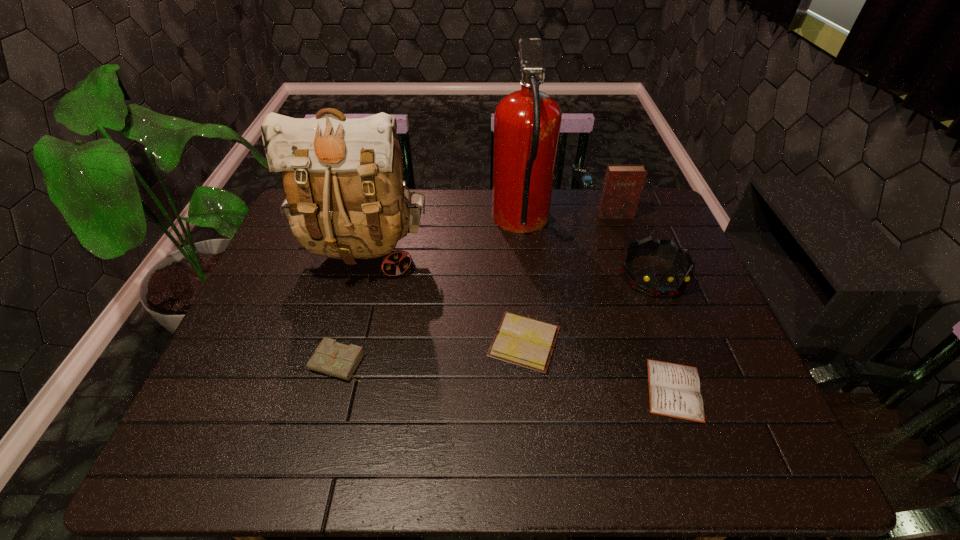
Locate an element on the screen. object that can be found as the closest to the third tallest object is located at coordinates (527, 122).

Identify which diary is the nearest to the backpack. Please provide its 2D coordinates. Your answer should be formatted as a tuple, i.e. [(x, y)], where the tuple contains the x and y coordinates of a point satisfying the conditions above.

[(332, 358)]

Find the location of `diary identified as the second closest to the fourth shortest object`. diary identified as the second closest to the fourth shortest object is located at coordinates tap(674, 390).

I want to click on free space in the image that satisfies the following two spatial constraints: 1. on the front side of the shortest object; 2. on the right side of the second shortest object, so coord(529,389).

The height and width of the screenshot is (540, 960). In order to click on free spot that satisfies the following two spatial constraints: 1. on the front-facing side of the second tallest object; 2. on the left side of the second shortest diary in this screenshot , I will do `click(340, 342)`.

This screenshot has width=960, height=540. I want to click on free spot that satisfies the following two spatial constraints: 1. with the handle and nozzle on the fire extinguisher; 2. on the front-facing side of the backpack, so coord(524,253).

Find the location of `vacant region that satisfies the following two spatial constraints: 1. with the handle and nozzle on the fire extinguisher; 2. on the front side of the leftmost diary`. vacant region that satisfies the following two spatial constraints: 1. with the handle and nozzle on the fire extinguisher; 2. on the front side of the leftmost diary is located at coordinates (536, 363).